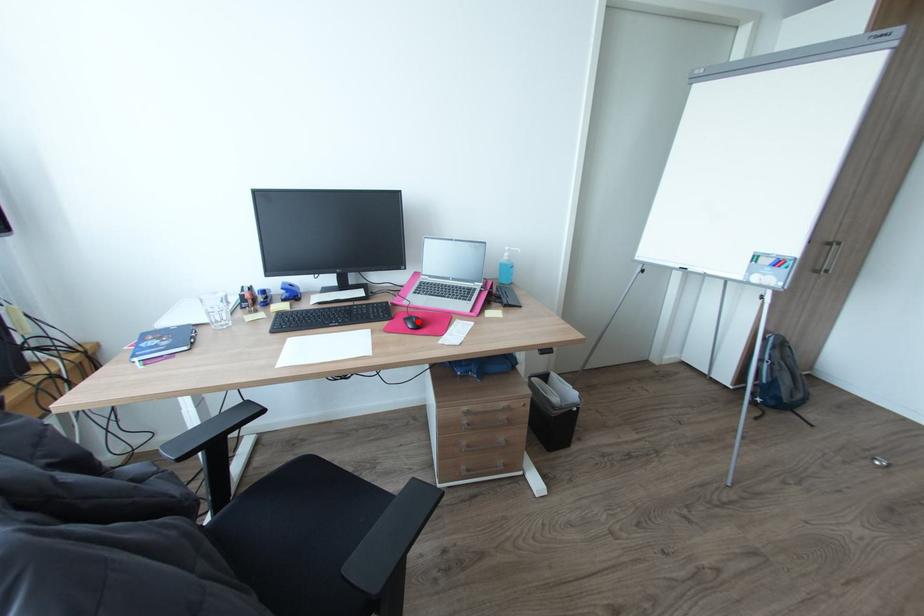
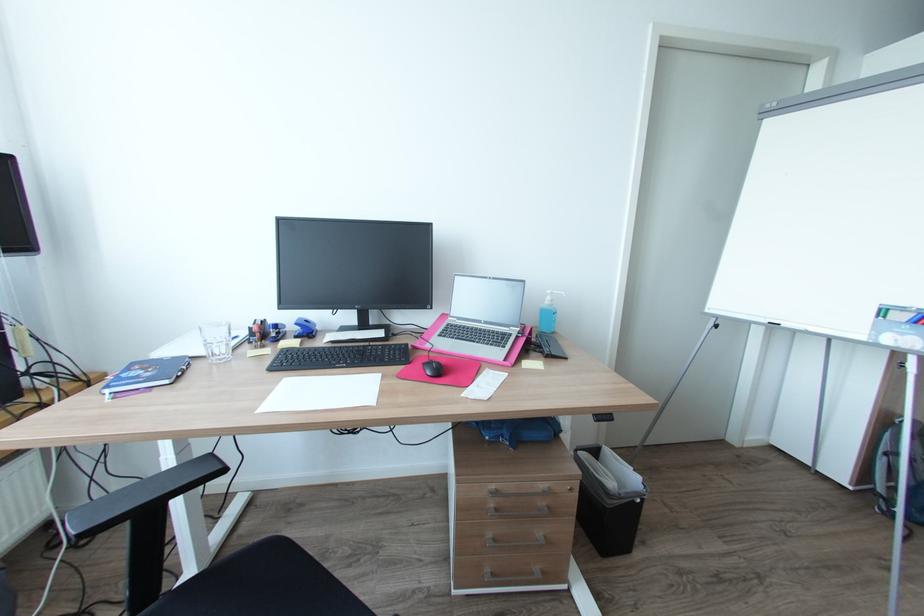
Find the pixel in the second image that matches the highlighted location in the first image.

(438, 368)